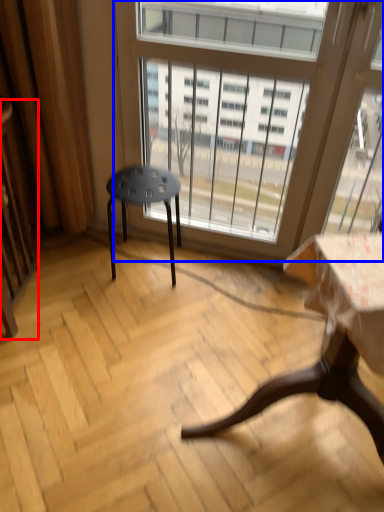
Question: Among these objects, which one is farthest to the camera, screen door (highlighted by a red box) or window (highlighted by a blue box)?

Choices:
 (A) screen door
 (B) window

Answer: (B)